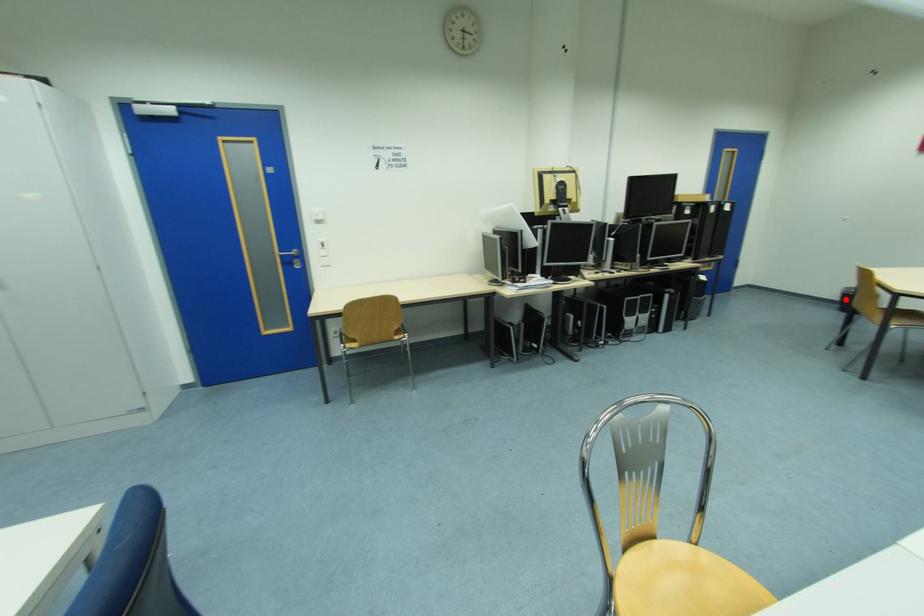
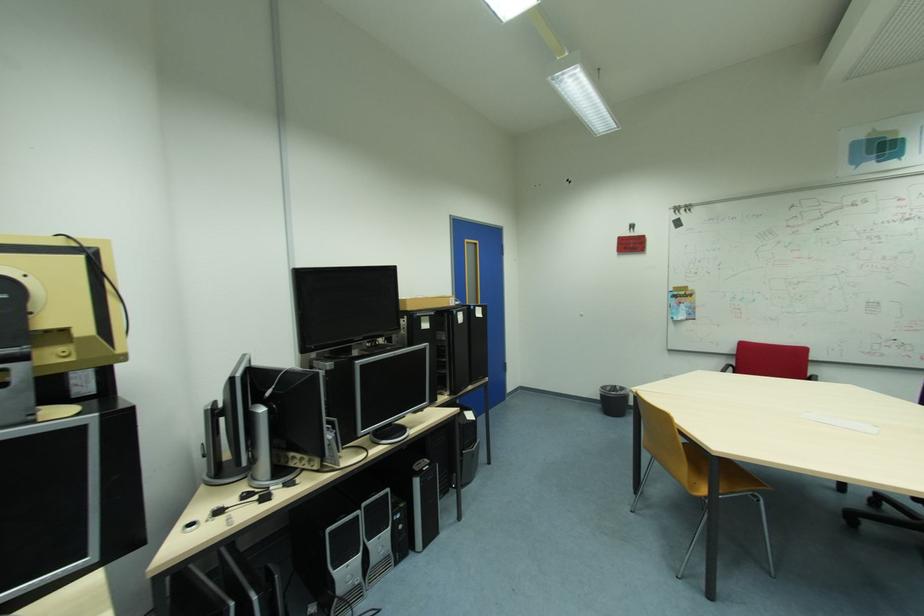
Question: I am providing you with two images of the same scene from different viewpoints. Given a red point in image1, look at the same physical point in image2. Is it:

Choices:
 (A) Closer to the viewpoint
 (B) Farther from the viewpoint

Answer: (A)